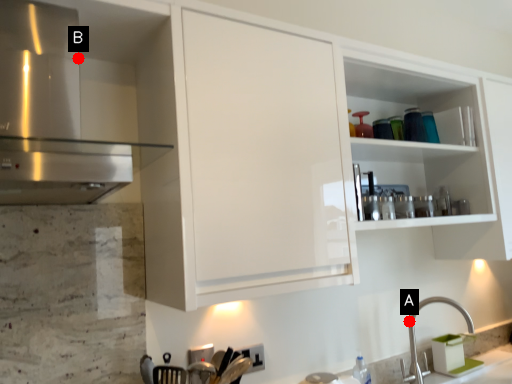
Question: Two points are circled on the image, labeled by A and B beside each circle. Among these points, which one is nearest to the camera?

Choices:
 (A) A is closer
 (B) B is closer

Answer: (B)